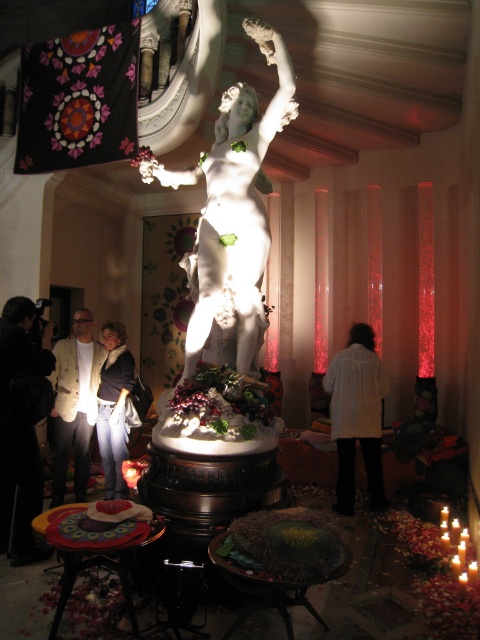
Question: Does white marble statue at center have a smaller size compared to black fabric at left?

Choices:
 (A) yes
 (B) no

Answer: (B)

Question: Which object appears closest to the camera in this image?

Choices:
 (A) jeans at lower left
 (B) white matte coat at center

Answer: (A)

Question: Where is white textured jacket at center located in relation to jeans at lower left in the image?

Choices:
 (A) left
 (B) right

Answer: (A)

Question: Which object is the closest to the black fabric at left?

Choices:
 (A) white textured jacket at center
 (B) jeans at lower left

Answer: (B)

Question: Which of these objects is positioned closest to the white matte coat at center?

Choices:
 (A) wooden stool at lower left
 (B) white textured jacket at center
 (C) white marble statue at center
 (D) black fabric at left

Answer: (C)

Question: Is wooden stool at lower left further to camera compared to jeans at lower left?

Choices:
 (A) no
 (B) yes

Answer: (A)